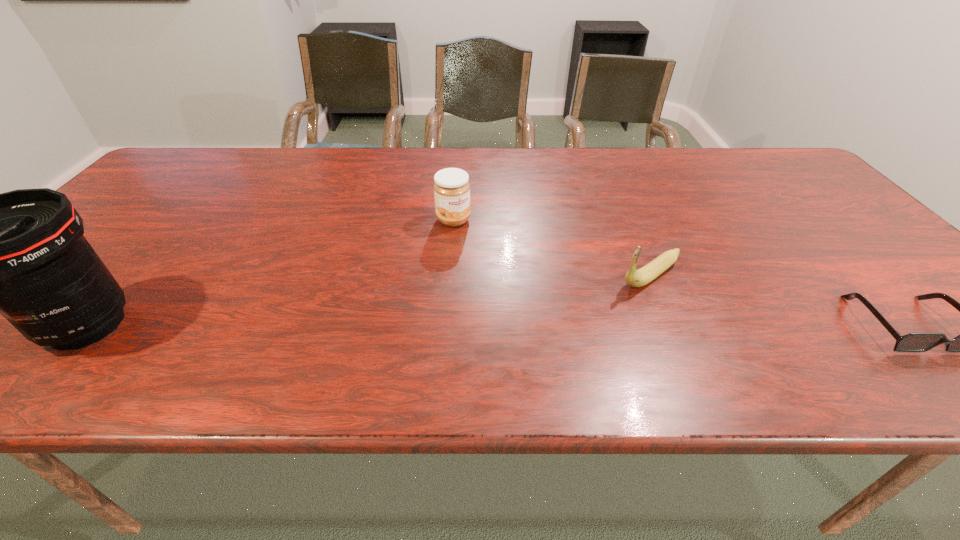
Locate an element on the screen. This screenshot has height=540, width=960. free space between the telephoto lens and the third object from left to right is located at coordinates (369, 300).

I want to click on free space between the second object from right to left and the jam, so click(552, 247).

You are a GUI agent. You are given a task and a screenshot of the screen. Output one action in this format:
    pyautogui.click(x=<x>, y=<y>)
    Task: Click on the object that is the third nearest to the shortest object
    This screenshot has height=540, width=960.
    Given the screenshot: What is the action you would take?
    pyautogui.click(x=22, y=253)

Find the location of `object identified as the third closest to the leftmost object`. object identified as the third closest to the leftmost object is located at coordinates (913, 342).

The height and width of the screenshot is (540, 960). I want to click on vacant space that satisfies the following two spatial constraints: 1. on the back side of the jam; 2. on the right side of the leftmost object, so click(x=180, y=220).